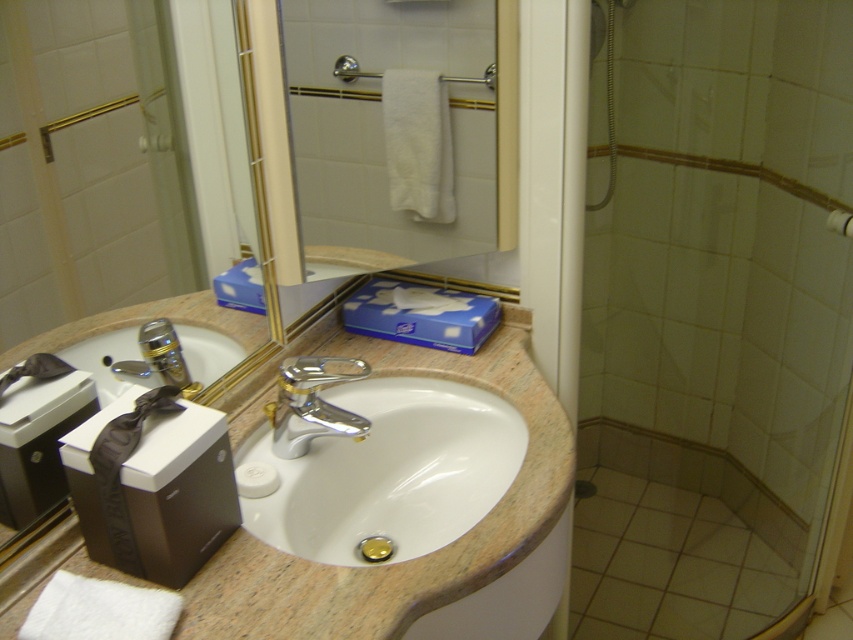
Question: Is transparent glass shower door at right positioned at the back of metallic gold mirror at center?

Choices:
 (A) no
 (B) yes

Answer: (B)

Question: Based on their relative distances, which object is farther from the white matte towel bar at upper center?

Choices:
 (A) marble-like beige sink at center
 (B) silver metallic faucet at sink center
 (C) polished chrome faucet at center

Answer: (B)

Question: Which of the following is the closest to the observer?

Choices:
 (A) (154, 336)
 (B) (846, 214)

Answer: (A)

Question: Can you confirm if metallic gold mirror at center is positioned to the left of chrome metallic sink at center?

Choices:
 (A) yes
 (B) no

Answer: (B)

Question: Does transparent glass shower door at right have a greater width compared to metallic gold mirror at center?

Choices:
 (A) no
 (B) yes

Answer: (A)

Question: Which object is positioned farthest from the metallic gold mirror at center?

Choices:
 (A) chrome metallic sink at center
 (B) marble-like beige sink at center
 (C) silver metallic faucet at sink center

Answer: (C)